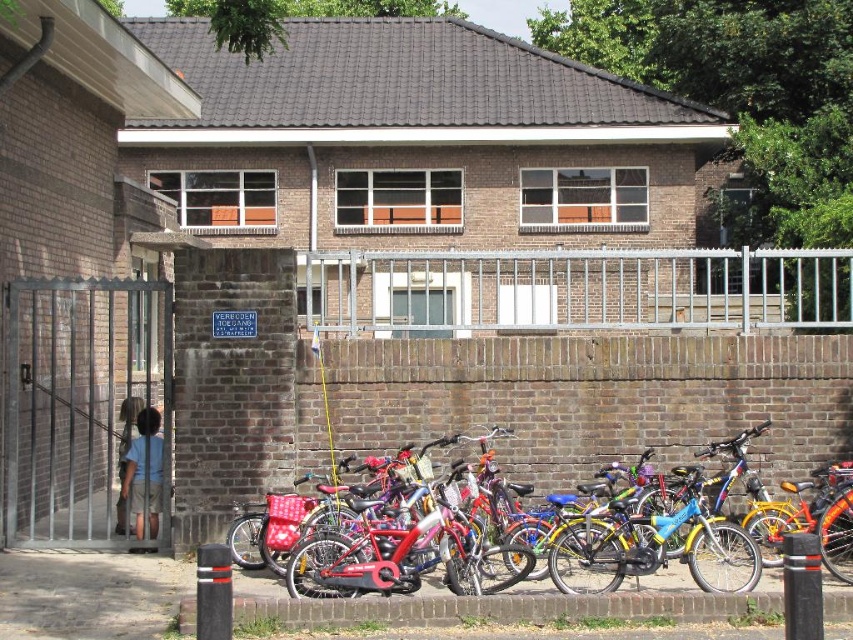
Question: Is silver metallic fence at center further to camera compared to metallic gate at left?

Choices:
 (A) yes
 (B) no

Answer: (B)

Question: Which object is closer to the camera taking this photo?

Choices:
 (A) silver metallic fence at center
 (B) metallic gate at left
 (C) shiny red bicycle at center

Answer: (C)

Question: Among these points, which one is farthest from the camera?

Choices:
 (A) (634, 310)
 (B) (746, 544)
 (C) (167, 378)

Answer: (A)

Question: Which object is farther from the camera taking this photo?

Choices:
 (A) silver metallic fence at center
 (B) shiny red bicycle at center
 (C) metallic gate at left

Answer: (C)

Question: Does silver metallic fence at center have a larger size compared to shiny red bicycle at center?

Choices:
 (A) yes
 (B) no

Answer: (A)

Question: Does metallic gate at left have a larger size compared to shiny red bicycle at center?

Choices:
 (A) yes
 (B) no

Answer: (B)